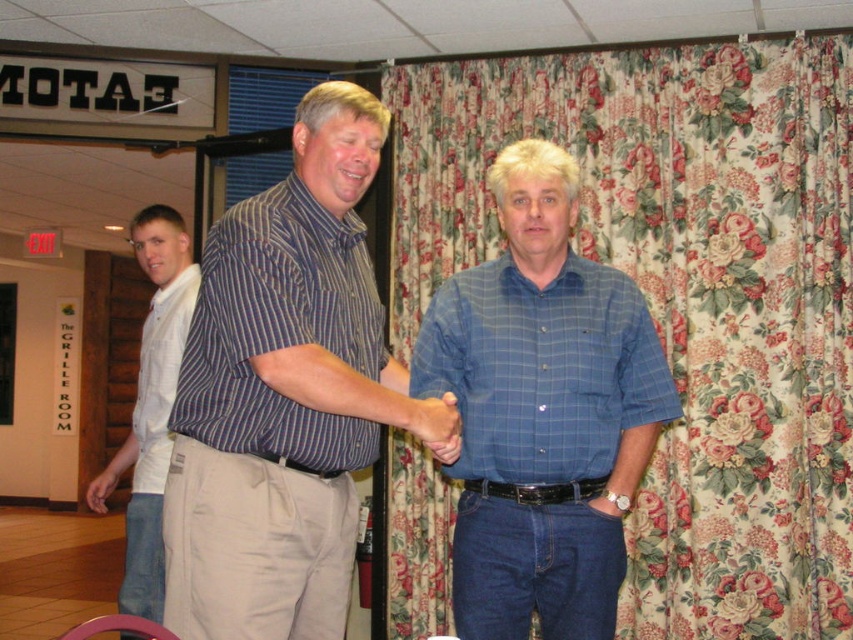
You are a photographer setting up for a group photo. You need to ensure that the floral fabric curtain at right and the white cotton shirt at left are both visible in the frame. Based on their heights, which object might require you to adjust the camera angle upwards to include its full height?

The floral fabric curtain at right has a greater height compared to the white cotton shirt at left, so you would need to adjust the camera angle upwards to include the full height of the floral fabric curtain at right.